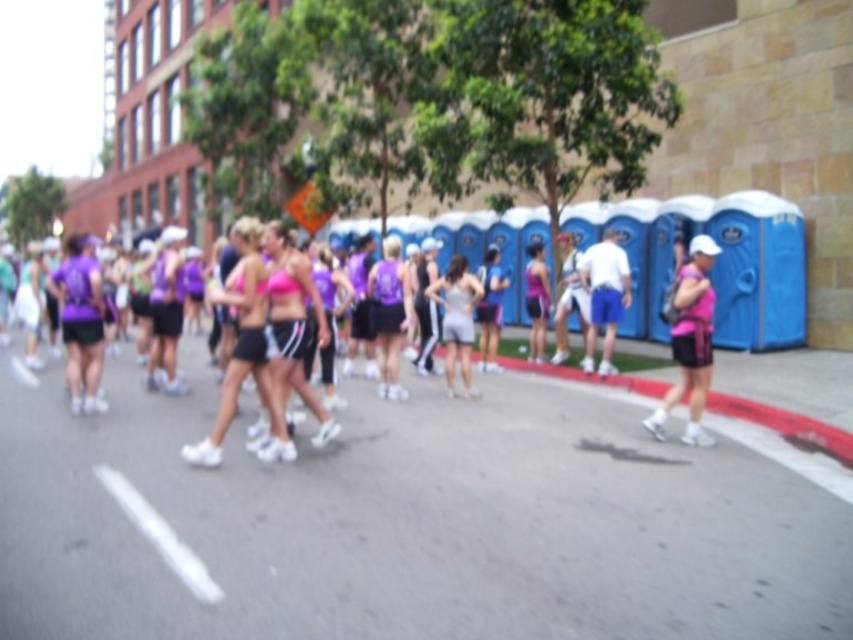
Question: Is pink matte tank top at center closer to camera compared to matte gray tank top at center?

Choices:
 (A) yes
 (B) no

Answer: (A)

Question: Which object is positioned farthest from the matte gray tank top at center?

Choices:
 (A) purple matte tank top at center
 (B) pink matte tank top at center

Answer: (B)

Question: Which point is closer to the camera taking this photo?

Choices:
 (A) (688, 369)
 (B) (395, 349)
 (C) (473, 298)

Answer: (A)

Question: Which point is closer to the camera?

Choices:
 (A) (691, 336)
 (B) (445, 323)

Answer: (A)

Question: Can you confirm if pink matte tank top at center is positioned to the right of purple matte tank top at center?

Choices:
 (A) yes
 (B) no

Answer: (A)

Question: Observing the image, what is the correct spatial positioning of purple matte tank top at center in reference to matte gray tank top at center?

Choices:
 (A) above
 (B) below

Answer: (B)